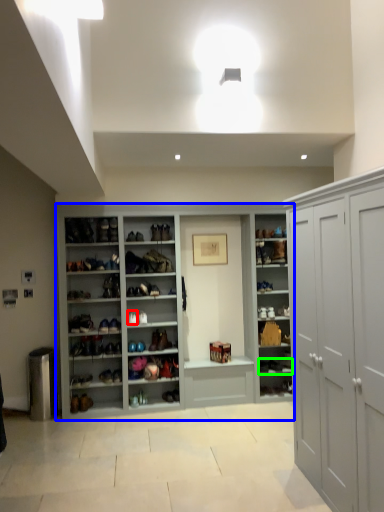
Question: Which object is positioned farthest from shoe (highlighted by a red box)? Select from cupboard (highlighted by a blue box) and footwear (highlighted by a green box).

Choices:
 (A) cupboard
 (B) footwear

Answer: (B)